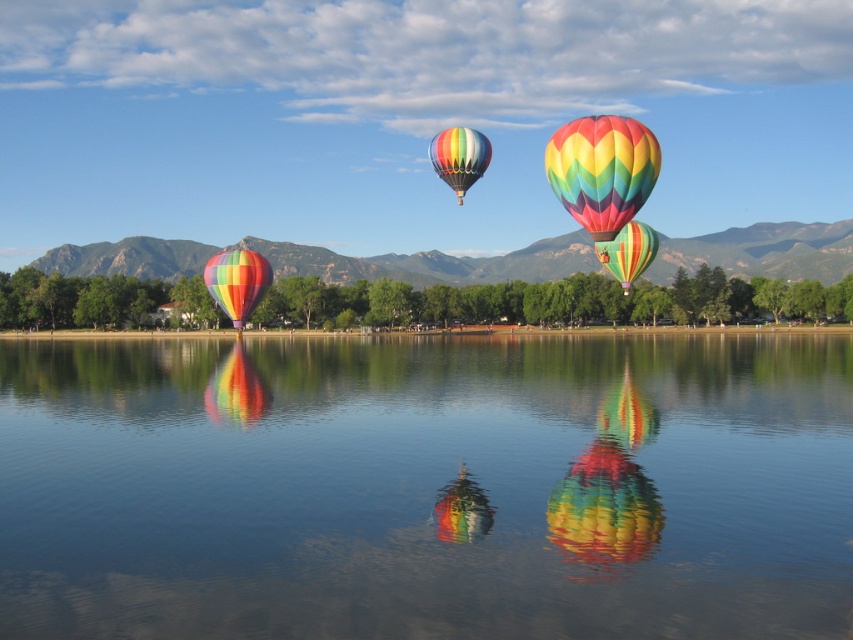
Question: In this image, where is multicolored glossy balloon at lower center located relative to multicolored fabric hot air balloon at center?

Choices:
 (A) left
 (B) right

Answer: (A)

Question: Which of the following is the closest to the observer?

Choices:
 (A) pos(587,547)
 (B) pos(434,170)
 (C) pos(633,266)

Answer: (A)

Question: Can you confirm if multicolored glossy balloon at lower center is positioned to the left of rainbow striped hot air balloon at upper center?

Choices:
 (A) no
 (B) yes

Answer: (B)

Question: Which is farther from the transparent glass water at center?

Choices:
 (A) rainbow striped hot air balloon at upper center
 (B) multicolored fabric hot air balloon at left
 (C) rainbow striped hot air balloon at center
 (D) rainbow fabric balloon at lower left

Answer: (B)

Question: Which point is closer to the camera?

Choices:
 (A) multicolored glossy balloon at lower center
 (B) rainbow fabric balloon at lower left
 (C) multicolored fabric hot air balloon at center
 (D) transparent glass water at center

Answer: (D)

Question: Considering the relative positions of multicolored fabric hot air balloon at left and rainbow striped hot air balloon at center in the image provided, where is multicolored fabric hot air balloon at left located with respect to rainbow striped hot air balloon at center?

Choices:
 (A) below
 (B) above

Answer: (A)